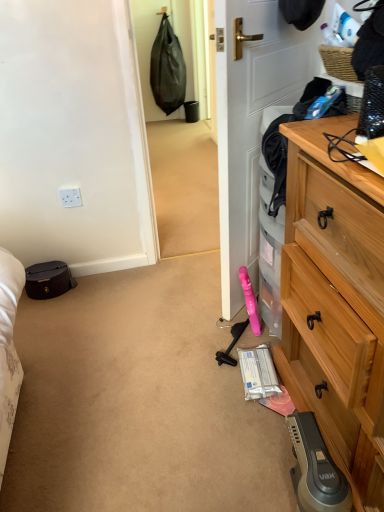
You are a GUI agent. You are given a task and a screenshot of the screen. Output one action in this format:
    pyautogui.click(x=<x>, y=<y>)
    Task: Click on the vacant area that is situated to the right of matte black suitcase at left
    This screenshot has width=384, height=512.
    Given the screenshot: What is the action you would take?
    pyautogui.click(x=87, y=290)